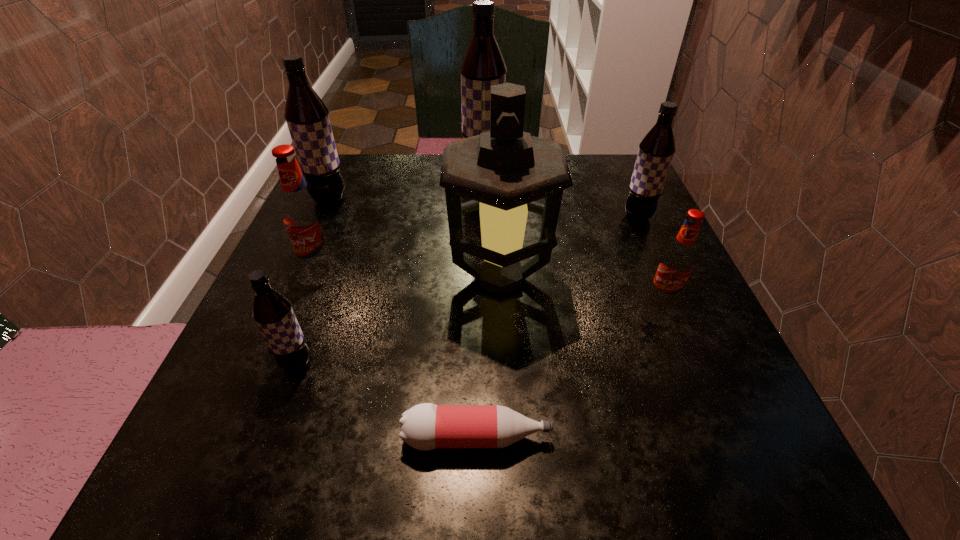
Image resolution: width=960 pixels, height=540 pixels. In order to click on the seventh farthest object in this screenshot , I will do `click(272, 311)`.

Find the location of a particular element. This screenshot has height=540, width=960. the nearest object is located at coordinates (426, 426).

In order to click on bottle in this screenshot , I will do `click(426, 426)`.

Where is `vacant region located 0.180m on the left of the third root beer from right to left`? This screenshot has width=960, height=540. vacant region located 0.180m on the left of the third root beer from right to left is located at coordinates (389, 171).

Find the location of `free space located on the front of the oil lamp`. free space located on the front of the oil lamp is located at coordinates (504, 364).

You are a GUI agent. You are given a task and a screenshot of the screen. Output one action in this format:
    pyautogui.click(x=<x>, y=<y>)
    Task: Click on the vacant space located on the right of the third smallest brown root beer
    
    Given the screenshot: What is the action you would take?
    pyautogui.click(x=393, y=200)

What are the coordinates of `vacant space located 0.180m on the right of the bigger red root beer` in the screenshot? It's located at (435, 267).

You are a GUI agent. You are given a task and a screenshot of the screen. Output one action in this format:
    pyautogui.click(x=<x>, y=<y>)
    Task: Click on the vacant space located on the front of the rightmost brown root beer
    
    Given the screenshot: What is the action you would take?
    pyautogui.click(x=671, y=289)

At what (x,y) coordinates should I click in order to perform the action: click on vacant point located 0.210m on the back of the nearer red root beer. Please return your answer as a coordinate pair (x, y). Looking at the image, I should click on pos(630,219).

Locate an element on the screen. The height and width of the screenshot is (540, 960). vacant space located 0.170m on the right of the smallest brown root beer is located at coordinates (426, 363).